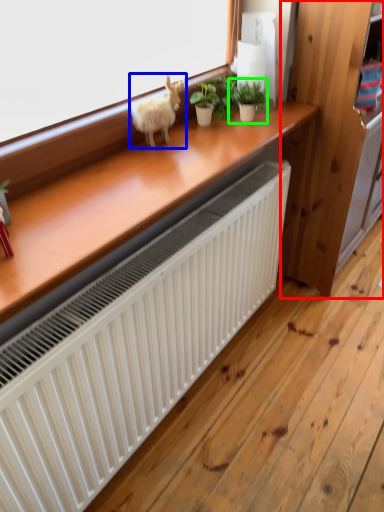
Question: Based on their relative distances, which object is nearer to dresser (highlighted by a red box)? Choose from animal (highlighted by a blue box) and houseplant (highlighted by a green box).

Choices:
 (A) animal
 (B) houseplant

Answer: (B)